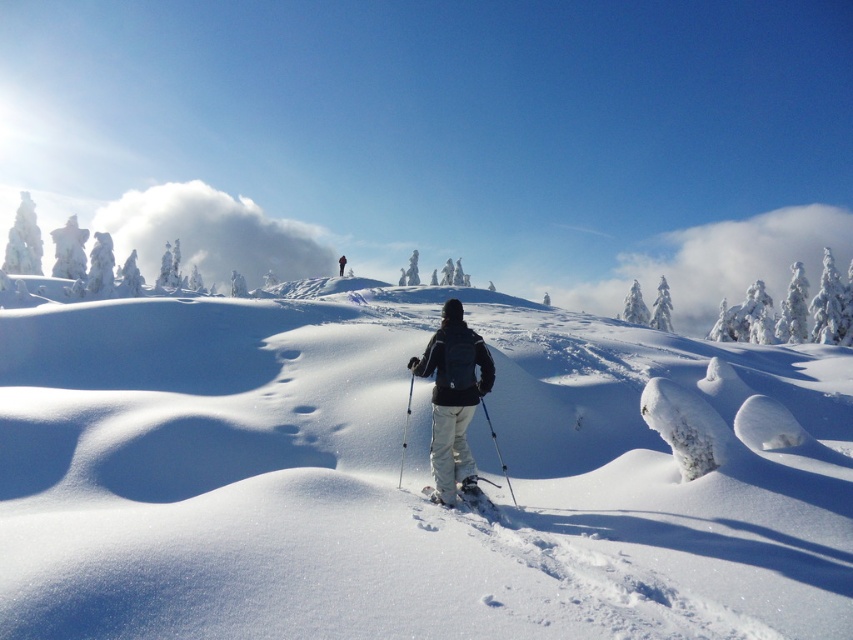
Can you confirm if white matte ski at center is positioned to the left of translucent blue ski pole at center?

In fact, white matte ski at center is to the right of translucent blue ski pole at center.

Between white matte ski at center and translucent blue ski pole at center, which one is positioned higher?

Positioned higher is translucent blue ski pole at center.

Is point (486, 504) farther from camera compared to point (399, 467)?

No.

Find the location of a particular element. The width and height of the screenshot is (853, 640). white matte ski at center is located at coordinates click(x=477, y=497).

Image resolution: width=853 pixels, height=640 pixels. In order to click on matte black jacket at center in this screenshot , I will do `click(453, 397)`.

Is matte black jacket at center closer to camera compared to white matte ski at center?

No, matte black jacket at center is further to the viewer.

Which is behind, point (456, 445) or point (422, 493)?

Point (422, 493)

Where is `matte black jacket at center`? matte black jacket at center is located at coordinates (453, 397).

Is point (445, 483) farther from camera compared to point (502, 461)?

No, it is in front of (502, 461).

The height and width of the screenshot is (640, 853). I want to click on matte black jacket at center, so click(x=453, y=397).